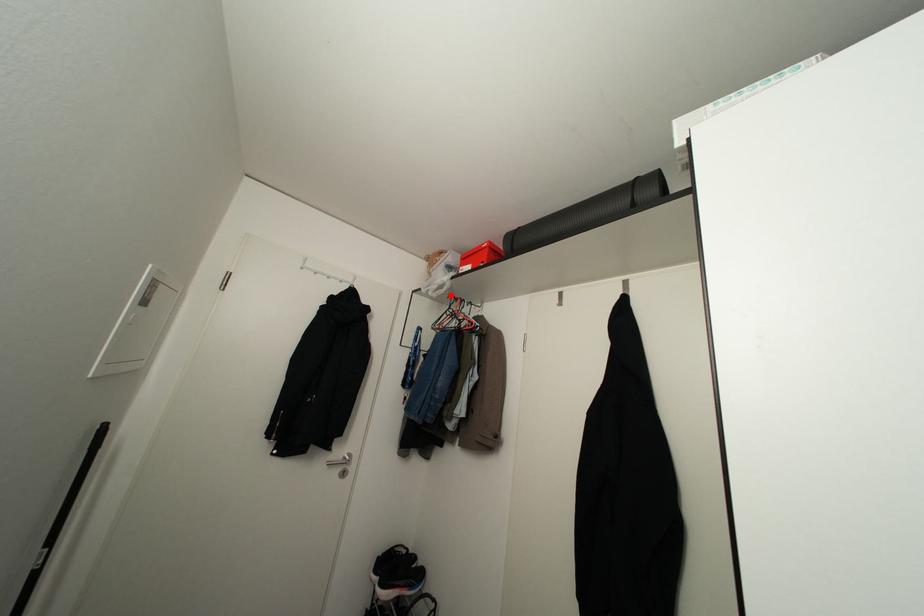
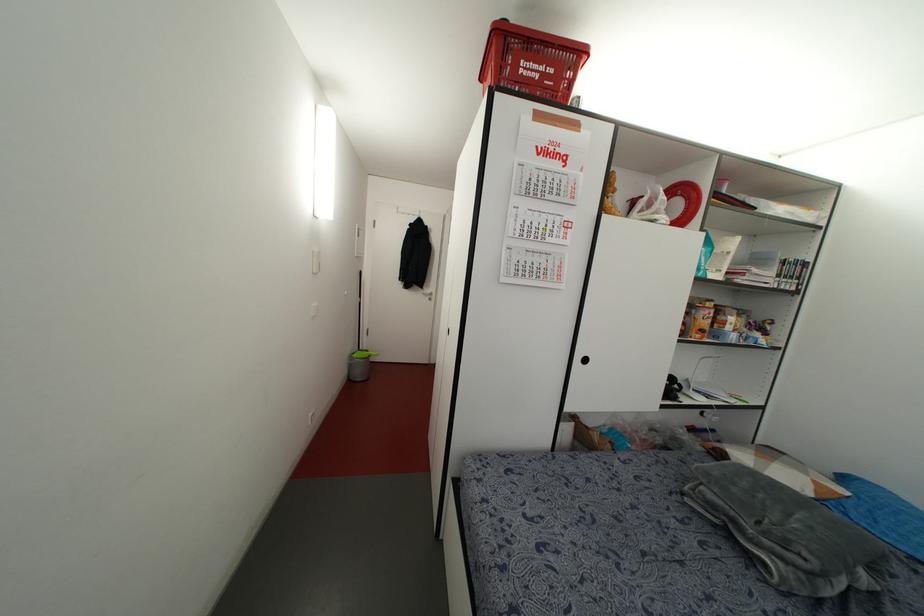
Question: I am providing you with two images of the same scene from different viewpoints. A red point is marked on the first image. Can you still see the location of the red point in image 2?

Choices:
 (A) Yes
 (B) No

Answer: (B)